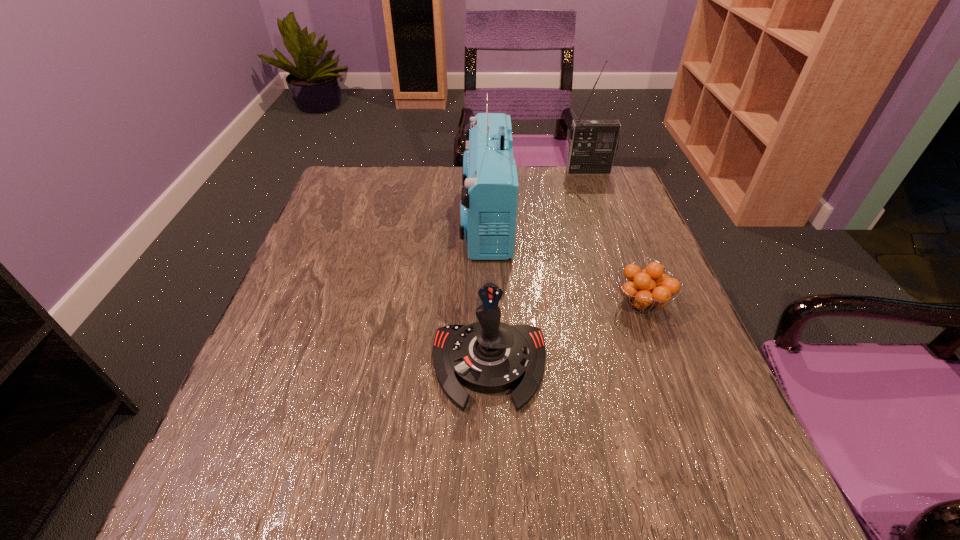
This screenshot has height=540, width=960. In the image, there is a desktop. What are the coordinates of `vacant space at the right edge` in the screenshot? It's located at (691, 423).

Locate an element on the screen. free spot at the far left corner of the desktop is located at coordinates (391, 184).

What are the coordinates of `free space at the far right corner of the desktop` in the screenshot? It's located at (614, 166).

This screenshot has width=960, height=540. What are the coordinates of `vacant space in between the joystick and the right radio receiver` in the screenshot? It's located at (539, 268).

Identify the location of vacant area that lies between the right radio receiver and the left radio receiver. Image resolution: width=960 pixels, height=540 pixels. (538, 195).

Where is `vacant area that lies between the third nearest object and the right radio receiver`? The image size is (960, 540). vacant area that lies between the third nearest object and the right radio receiver is located at coordinates (538, 195).

Locate an element on the screen. Image resolution: width=960 pixels, height=540 pixels. free space between the orange fruit and the right radio receiver is located at coordinates (614, 237).

This screenshot has width=960, height=540. I want to click on free space between the left radio receiver and the right radio receiver, so click(538, 195).

The width and height of the screenshot is (960, 540). I want to click on free area in between the farther radio receiver and the shortest object, so click(614, 237).

Image resolution: width=960 pixels, height=540 pixels. What are the coordinates of `unoccupied area between the joystick and the third farthest object` in the screenshot? It's located at (565, 334).